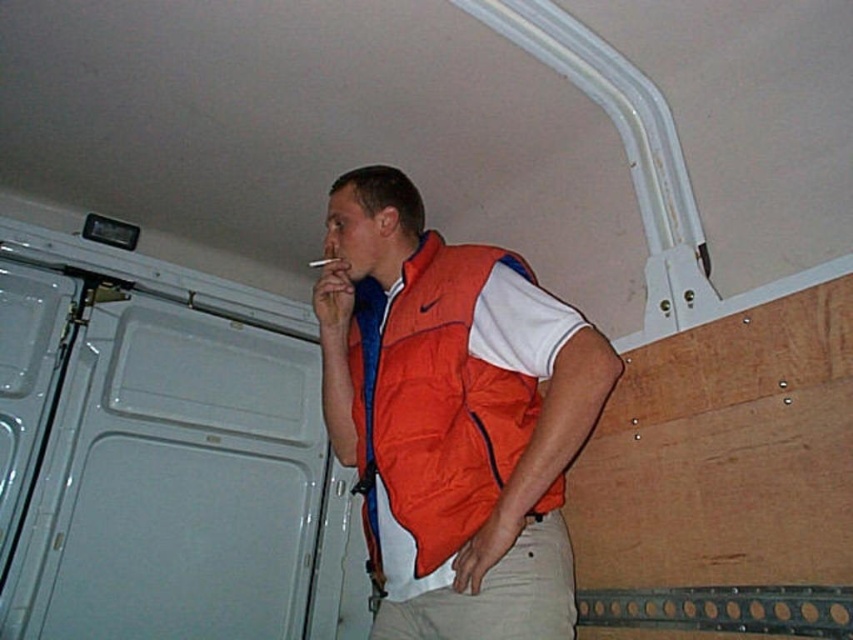
You are a safety inspector at a construction site. You need to ensure that all workers are wearing their safety gear properly. The safety regulations state that the vest must be worn so that it is visible from at least 2 meters away. Based on the image, is the orange puffer vest at center compliant with this regulation?

The orange puffer vest at center is only 1.06 meters away from the viewer, which is within the required visibility distance of 2 meters. Therefore, it complies with the safety regulation.

The man is wearing two items of clothing. Which one is covering the other? Please refer to the orange puffer vest at center and the khaki cotton pants at lower center.

The orange puffer vest at center is positioned over khaki cotton pants at lower center, so the vest is covering the pants.